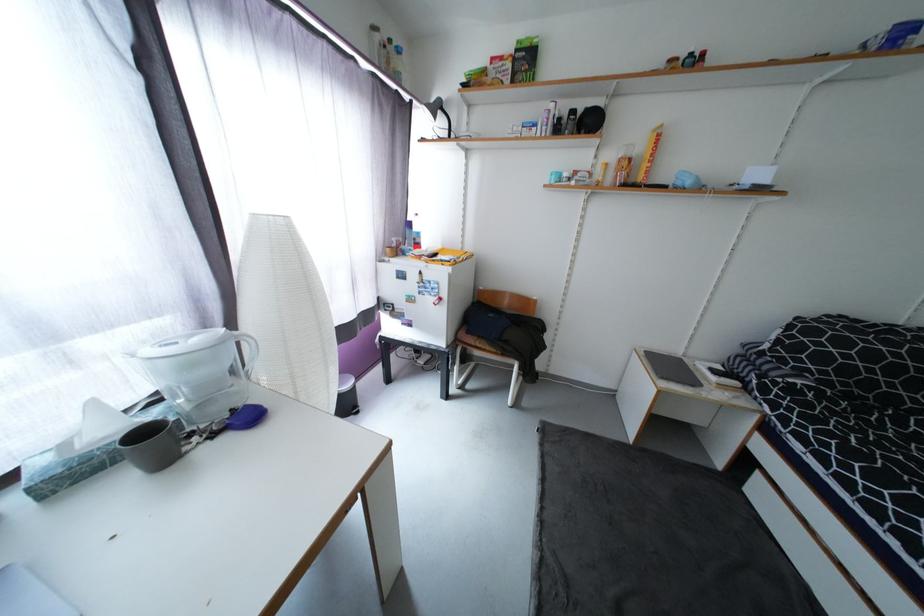
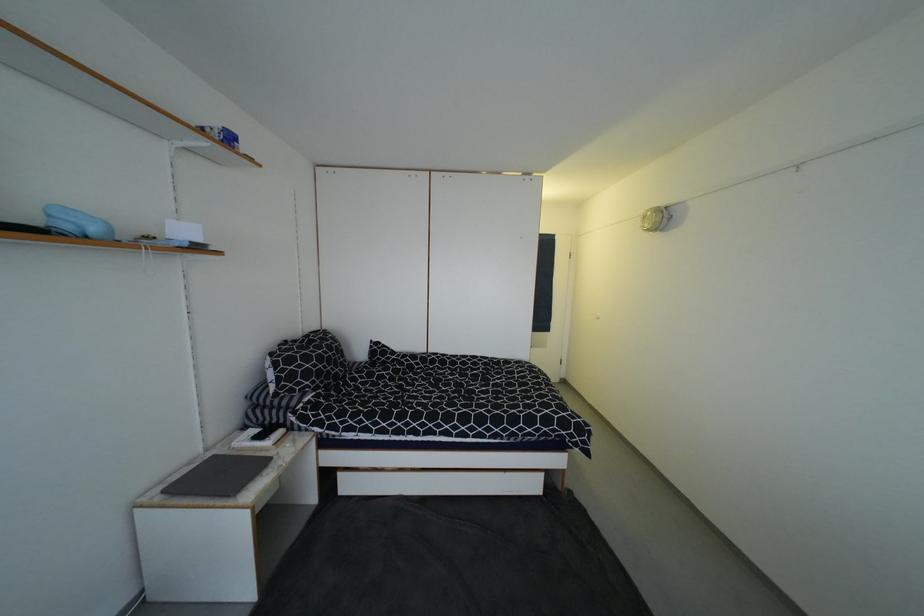
Where in the second image is the point corresponding to (x=870, y=46) from the first image?

(208, 131)